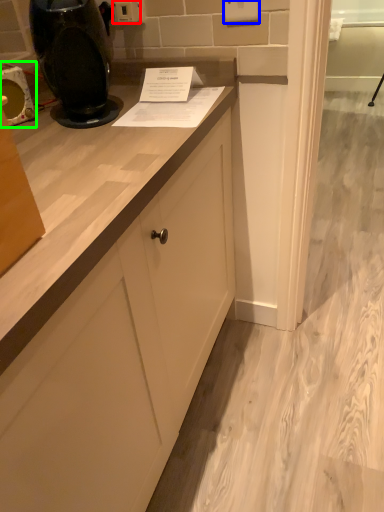
Question: Which object is positioned closest to electric outlet (highlighted by a red box)? Select from electric outlet (highlighted by a blue box) and appliance (highlighted by a green box).

Choices:
 (A) electric outlet
 (B) appliance

Answer: (A)